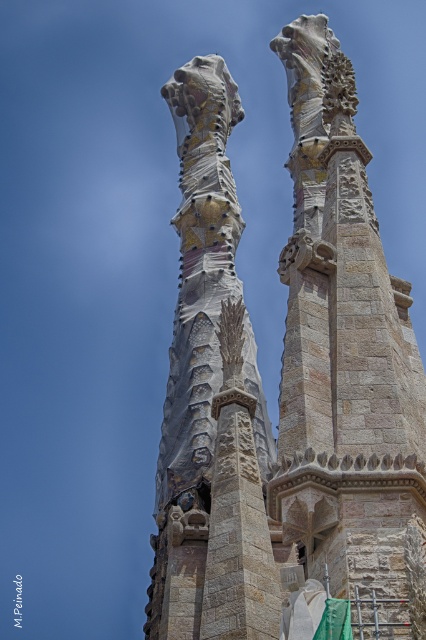
Question: Can you confirm if stone textured spire at center is smaller than stone textured column at center?

Choices:
 (A) yes
 (B) no

Answer: (B)

Question: Which point is closer to the camera?

Choices:
 (A) (414, 556)
 (B) (244, 346)

Answer: (A)

Question: Does stone textured spire at center appear under stone textured column at center?

Choices:
 (A) yes
 (B) no

Answer: (B)

Question: Is the position of stone textured spire at center less distant than that of stone textured column at center?

Choices:
 (A) yes
 (B) no

Answer: (A)

Question: Which point is farther from the camera taking this photo?

Choices:
 (A) (356, 170)
 (B) (213, 385)

Answer: (B)